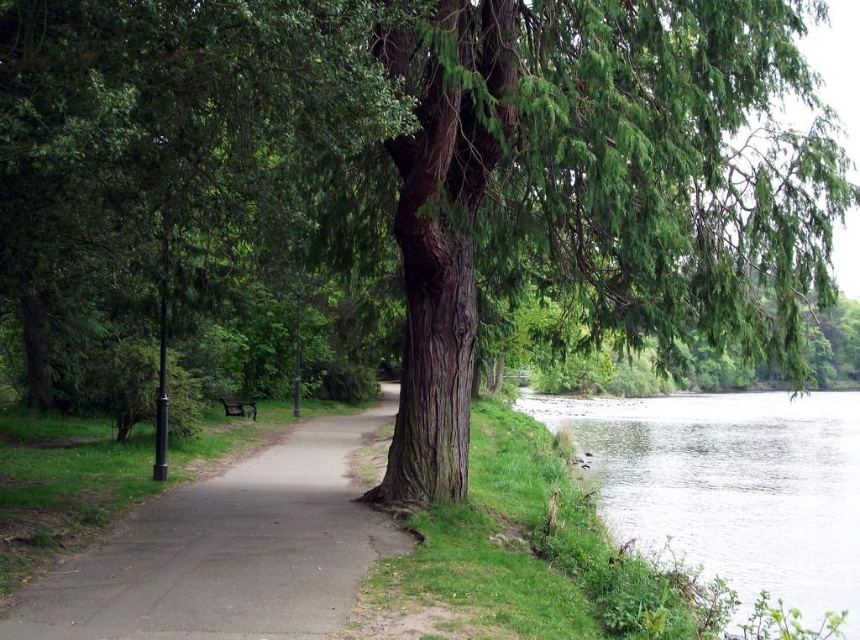
Question: Based on their relative distances, which object is nearer to the green grassy river at lower right?

Choices:
 (A) smooth asphalt path at center
 (B) dark brown wooden bench at center

Answer: (A)

Question: Which point is closer to the camera taking this photo?

Choices:
 (A) (346, 554)
 (B) (624, 456)

Answer: (A)

Question: From the image, what is the correct spatial relationship of smooth asphalt path at center in relation to green grassy river at lower right?

Choices:
 (A) above
 (B) below

Answer: (A)

Question: Which point is farther to the camera?

Choices:
 (A) (281, 628)
 (B) (240, 403)

Answer: (B)

Question: Does smooth asphalt path at center appear over dark brown wooden bench at center?

Choices:
 (A) no
 (B) yes

Answer: (A)

Question: Is smooth asphalt path at center to the left of green grassy river at lower right from the viewer's perspective?

Choices:
 (A) yes
 (B) no

Answer: (A)